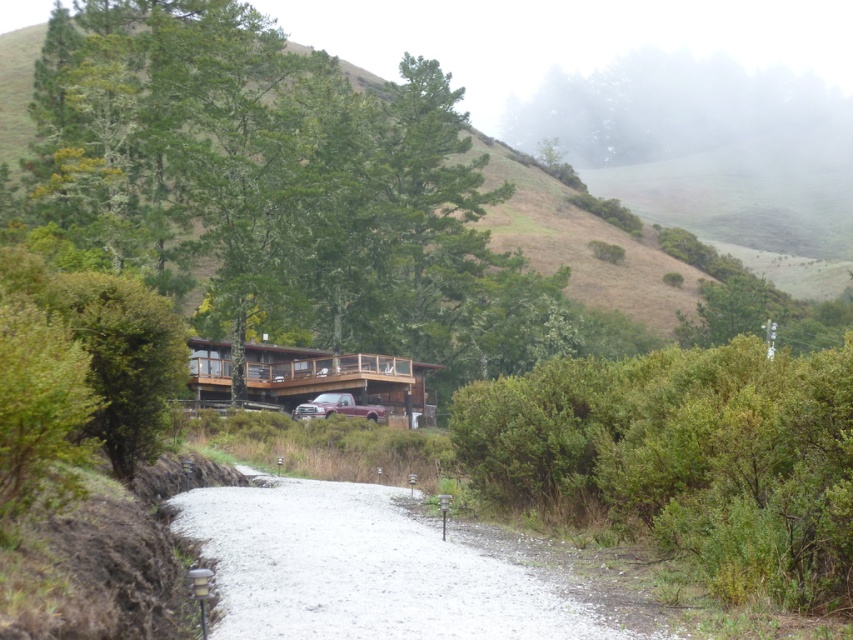
You are standing at the camera position and want to place a 10 meter long fence that starts at the green leafy bush at center and extends straight away from it. Will the fence reach the edge of the property?

The distance between the green leafy bush at center and the camera is 8.23 meters. Since the fence is 10 meters long, it will extend beyond the camera position by 1.77 meters, so yes, the fence will reach the edge of the property.

You are standing at the entrance of the gravel path leading to the house. You see the green leafy bush at center and the metallic maroon truck at center. Which object is positioned to the right when facing the house?

The green leafy bush at center is positioned to the right of the metallic maroon truck at center when facing the house.